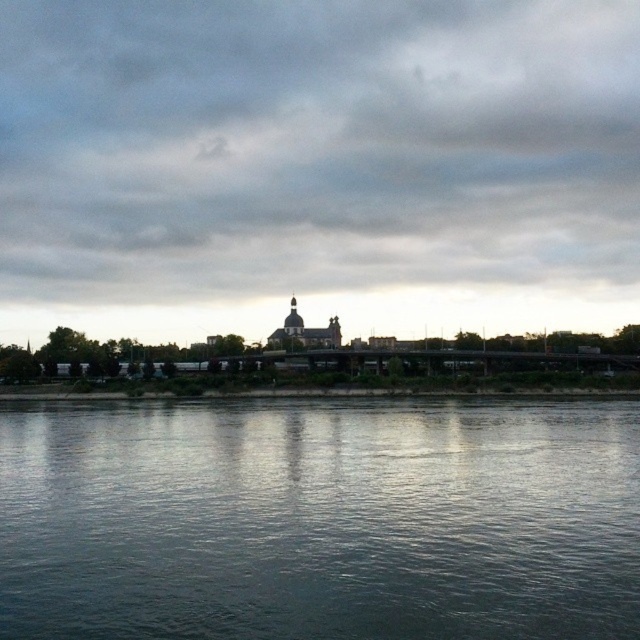
You are standing on the riverside path and want to take a photo of the cloudy sky at upper center and blue water at lower center. Which object should you point your camera upwards to capture?

You should point your camera upwards to capture the cloudy sky at upper center because it is positioned over the blue water at lower center.